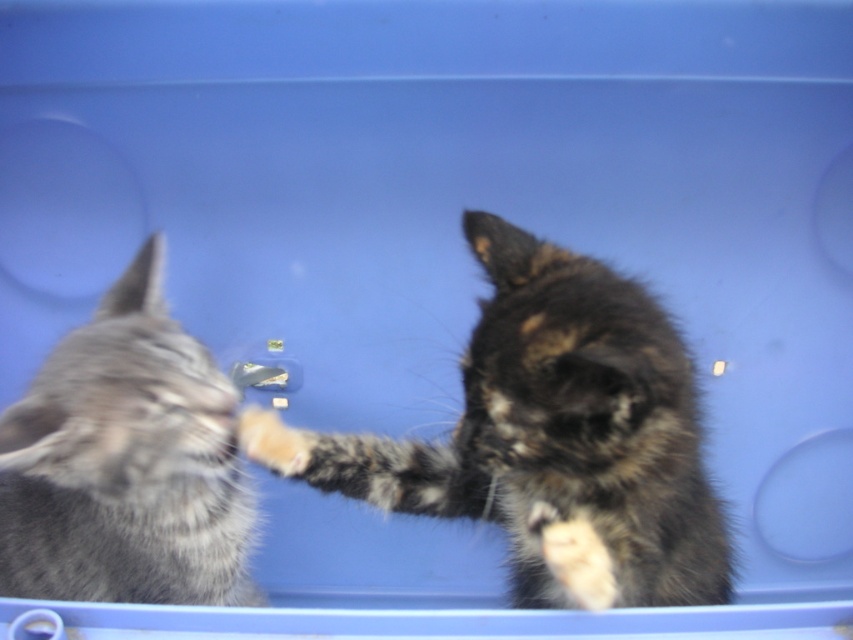
Looking at this image, you are a cat breeder who wants to place both kittens in a new enclosure. The enclosure has a maximum weight capacity of 5 kilograms. If the gray fluffy cat at left weighs 2 kilograms, can the tabby fur cat at center also be placed in the enclosure without exceeding the weight limit?

The tabby fur cat at center is bigger than the gray fluffy cat at left, which weighs 2 kilograms. Since the tabby fur cat is larger, it likely weighs more than 2 kilograms. Adding both would exceed the 5 kg limit. Therefore, they cannot be placed together in the enclosure.

You are a photographer trying to capture both point (544,323) and point (64,419) in the same frame. Based on their positions, which point is closer to the camera?

Point (544,323) is further to the viewer than point (64,419), so the latter is closer to the camera.

You are a cat owner trying to separate your two kittens. You see the tabby fur cat at center and the gray fluffy cat at left. Which kitten should you approach first if you want to reach the one on the left side of the container?

You should approach the gray fluffy cat at left first because it is located on the left side of the container, while the tabby fur cat at center is positioned to its right.